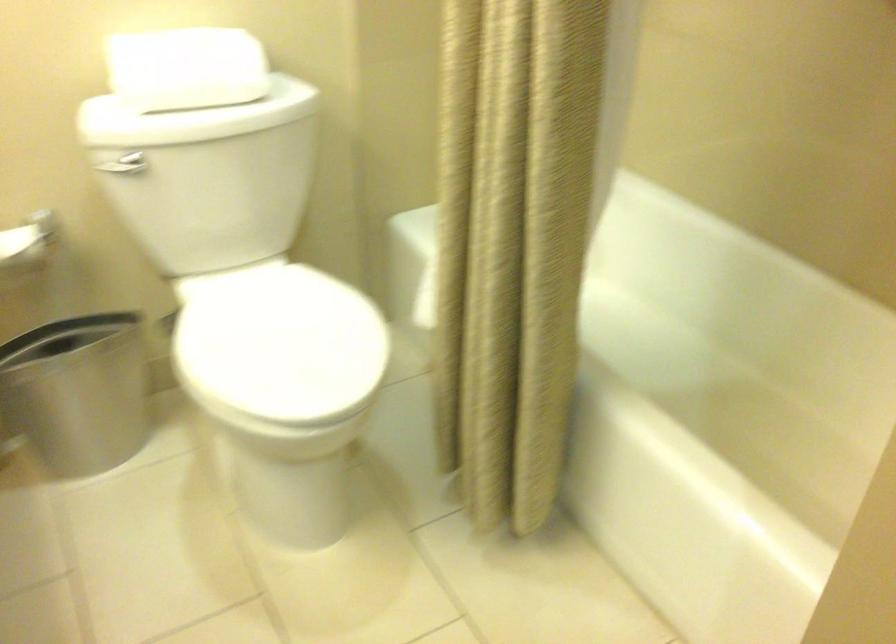
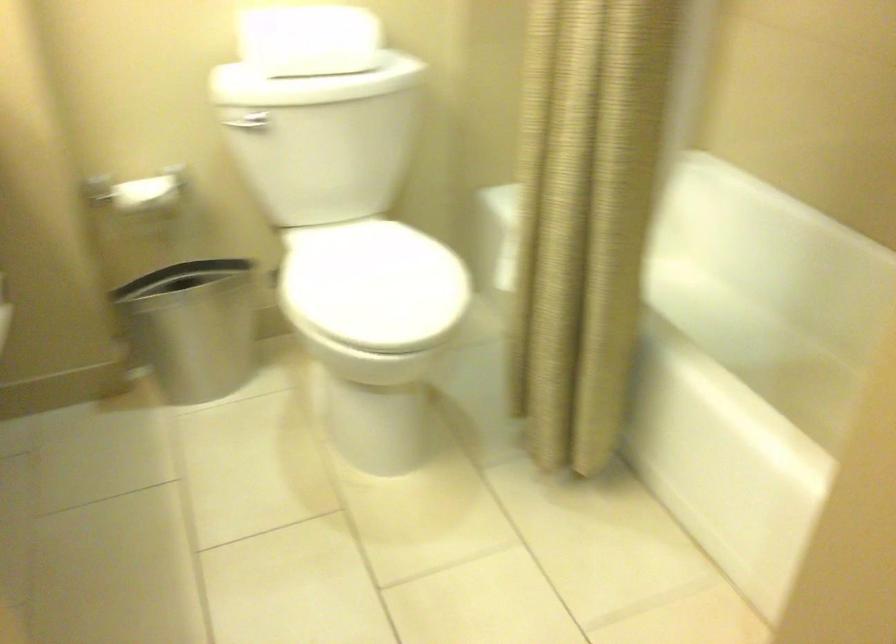
In a continuous first-person perspective shot, in which direction is the camera moving?

The cameraman walked toward right, backward.